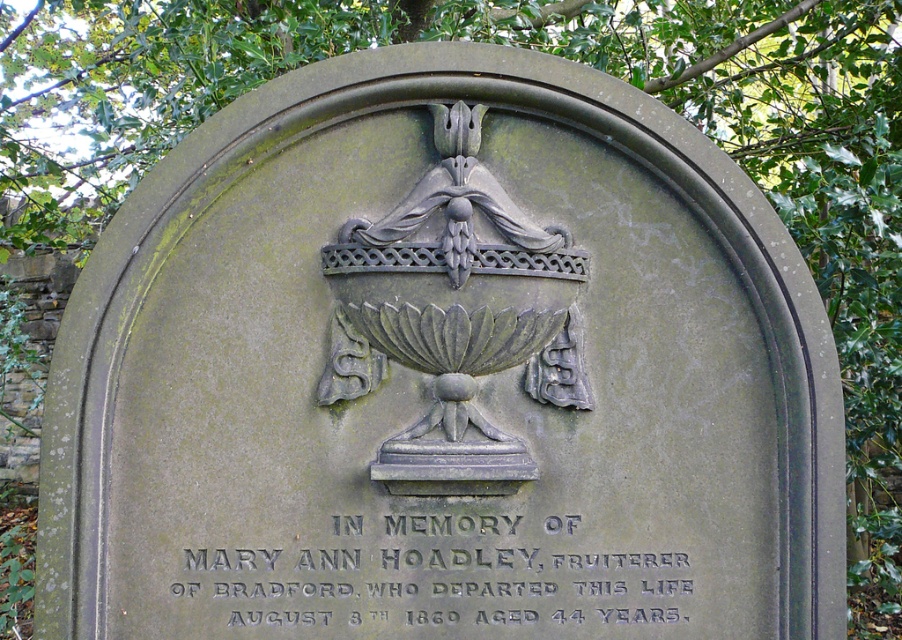
Does black engraved text at center appear under dark gray stone urn at center?

Correct, black engraved text at center is located below dark gray stone urn at center.

Does black engraved text at center have a greater height compared to dark gray stone urn at center?

In fact, black engraved text at center may be shorter than dark gray stone urn at center.

This screenshot has width=902, height=640. What do you see at coordinates (440, 560) in the screenshot?
I see `black engraved text at center` at bounding box center [440, 560].

Locate an element on the screen. black engraved text at center is located at coordinates (440, 560).